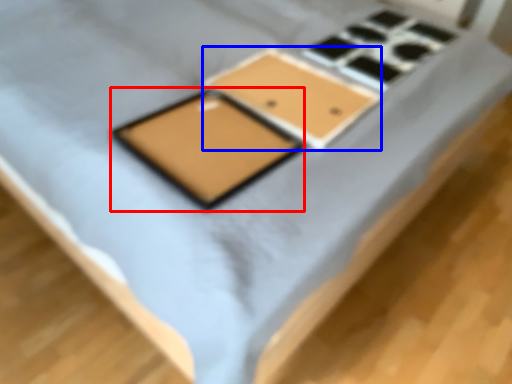
Question: Which object is further to the camera taking this photo, tablet computer (highlighted by a red box) or rectangle (highlighted by a blue box)?

Choices:
 (A) tablet computer
 (B) rectangle

Answer: (B)